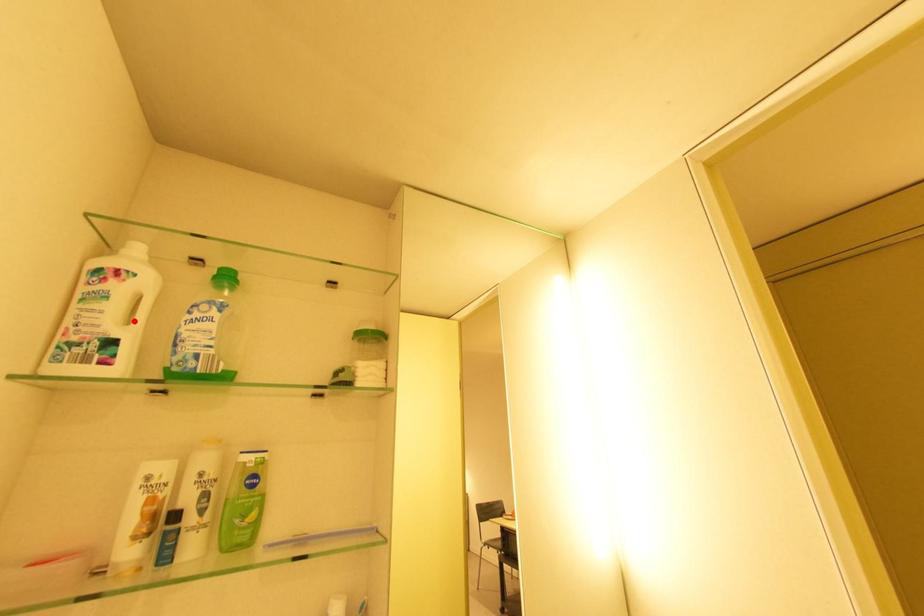
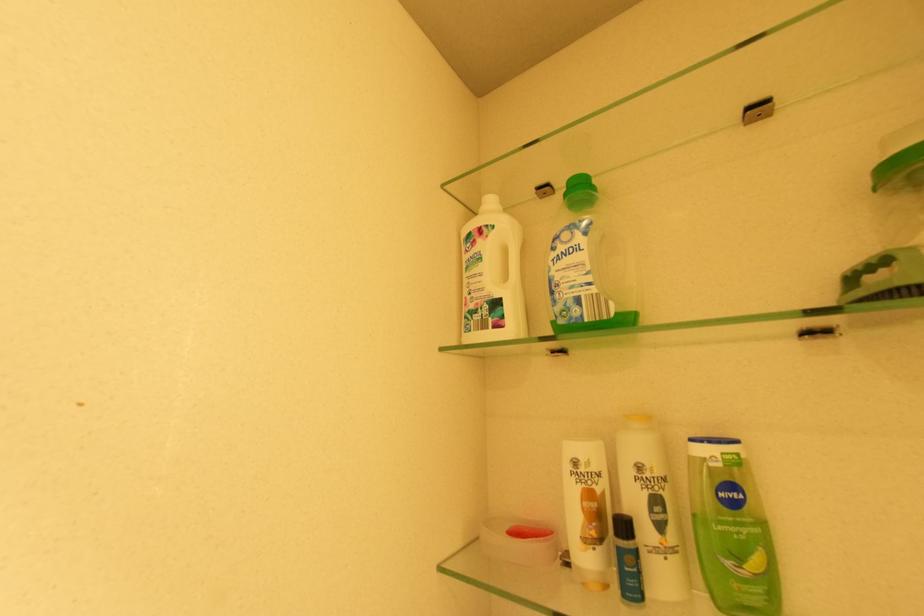
Locate, in the second image, the point that corresponds to the highlighted location in the first image.

(511, 278)